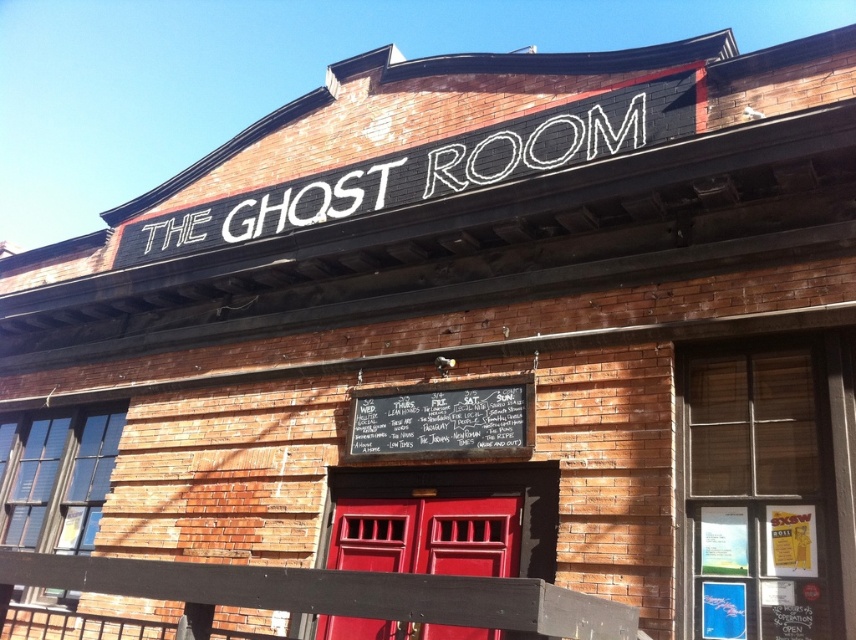
Based on the photo, you are standing in front of The Ghost Room building and want to take a photo of the point at coordinates (467, 508). Your camera has a depth sensor that can focus up to 5 meters. Will the camera be able to focus on the point?

The distance of point (467, 508) from camera is 5.16 meters, which is beyond the camera sensor limit of 5 meters. The camera will not be able to focus on the point.

You are standing in front of The Ghost Room building and notice two points marked on the wall. The first point is at coordinates point (339, 616) and the second is at point (525, 442). Which point is closer to you?

Point (339, 616) is in front of point (525, 442), so the first point is closer to you.